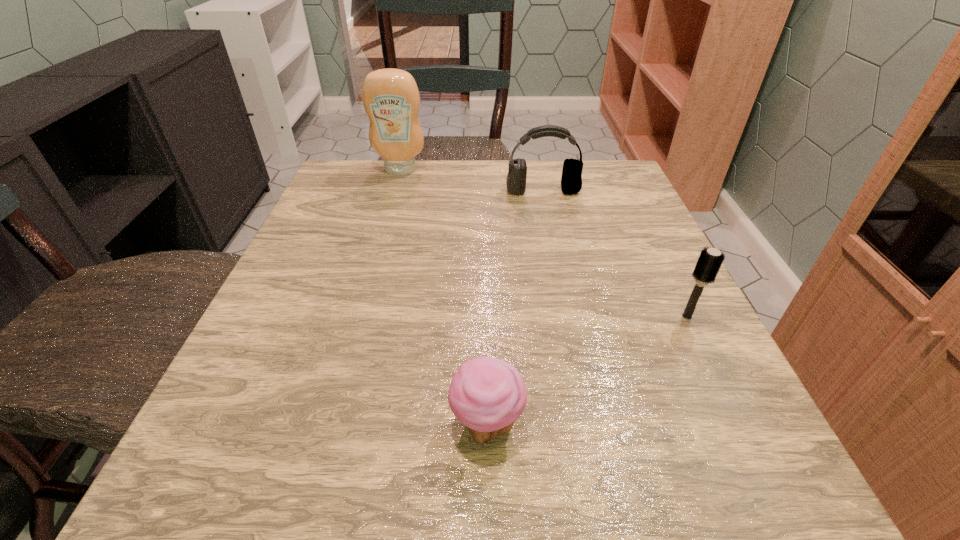
This screenshot has width=960, height=540. Find the location of `empty space between the farthest object and the rightmost object`. empty space between the farthest object and the rightmost object is located at coordinates [543, 243].

Identify the location of free space that is in between the shortest object and the hairbrush. (587, 370).

In order to click on vacant point located between the second nearest object and the shortest object in this screenshot , I will do `click(587, 370)`.

Locate an element on the screen. Image resolution: width=960 pixels, height=540 pixels. unoccupied position between the second nearest object and the condiment is located at coordinates (543, 243).

At what (x,y) coordinates should I click in order to perform the action: click on free space between the hairbrush and the shortest object. Please return your answer as a coordinate pair (x, y). The width and height of the screenshot is (960, 540). Looking at the image, I should click on (587, 370).

Find the location of a particular element. vacant region between the cupcake and the rightmost object is located at coordinates (587, 370).

Identify which object is the third nearest to the farthest object. Please provide its 2D coordinates. Your answer should be formatted as a tuple, i.e. [(x, y)], where the tuple contains the x and y coordinates of a point satisfying the conditions above.

[(710, 260)]

Select which object appears as the third closest to the shortest object. Please provide its 2D coordinates. Your answer should be formatted as a tuple, i.e. [(x, y)], where the tuple contains the x and y coordinates of a point satisfying the conditions above.

[(391, 99)]

This screenshot has height=540, width=960. I want to click on free space in the image that satisfies the following two spatial constraints: 1. on the label of the tallest object; 2. on the left side of the shortest object, so click(x=327, y=425).

Find the location of a particular element. vacant region that satisfies the following two spatial constraints: 1. on the back side of the second object from left to right; 2. on the left side of the third tallest object is located at coordinates (486, 316).